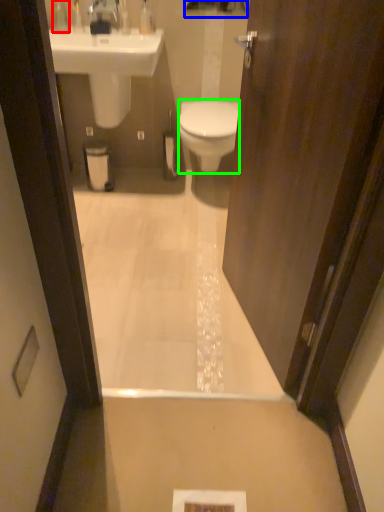
Question: Which object is positioned farthest from toiletry (highlighted by a red box)? Select from mirror (highlighted by a blue box) and bidet (highlighted by a green box).

Choices:
 (A) mirror
 (B) bidet

Answer: (B)